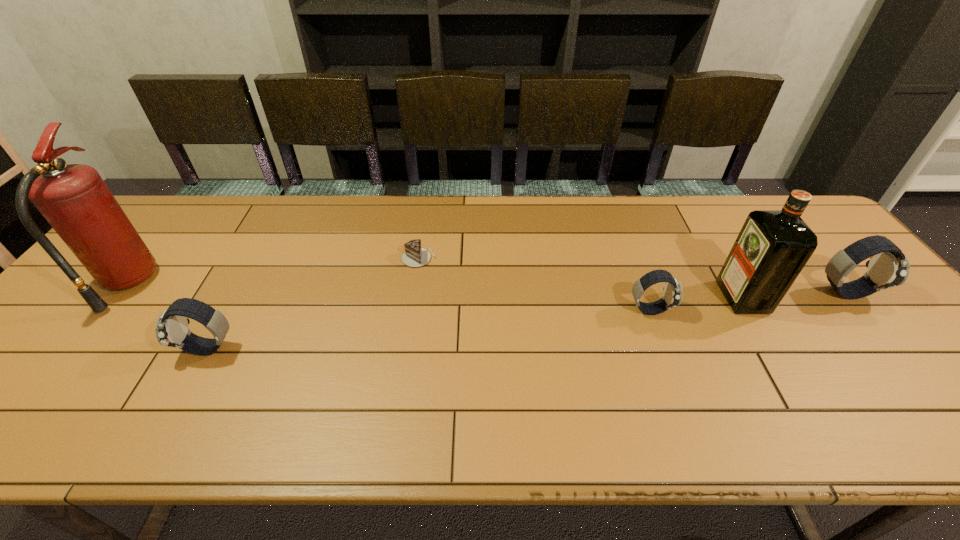
Locate an element on the screen. This screenshot has height=540, width=960. the second shortest watch is located at coordinates (171, 329).

At what (x,y) coordinates should I click in order to perform the action: click on the nearest object. Please return your answer as a coordinate pair (x, y). Looking at the image, I should click on pos(171,329).

Find the location of a particular element. This screenshot has width=960, height=540. the second watch from right to left is located at coordinates (672, 297).

Locate an element on the screen. the shortest watch is located at coordinates coord(672,297).

The height and width of the screenshot is (540, 960). I want to click on the rightmost watch, so click(888, 267).

I want to click on fire extinguisher, so click(74, 199).

Where is `the tallest object`? the tallest object is located at coordinates coord(74,199).

Where is `chocolate cake`? chocolate cake is located at coordinates (414, 256).

Find the location of a particular element. The image size is (960, 540). the shortest object is located at coordinates (414, 256).

This screenshot has width=960, height=540. I want to click on the fifth object from left to right, so click(x=773, y=246).